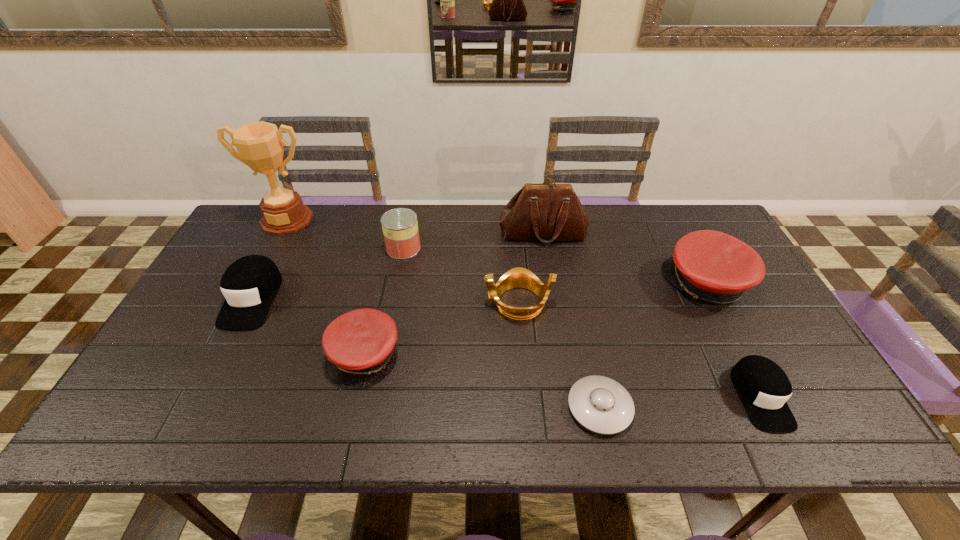
Locate an element on the screen. Image resolution: width=960 pixels, height=540 pixels. the smaller red cap is located at coordinates pos(357,344).

Find the location of a particular element. Image resolution: width=960 pixels, height=540 pixels. the right black cap is located at coordinates (763, 386).

Where is `the second shortest object`? the second shortest object is located at coordinates (763, 386).

Locate an element on the screen. This screenshot has width=960, height=540. the shortest object is located at coordinates (600, 404).

The image size is (960, 540). I want to click on gray saucer, so click(600, 404).

I want to click on free space located on the front-facing side of the tallest object, so click(256, 278).

You are a GUI agent. You are given a task and a screenshot of the screen. Output one action in this format:
    pyautogui.click(x=<x>, y=<y>)
    Task: Click on the free point located 0.260m on the front of the shoulder bag
    
    Given the screenshot: What is the action you would take?
    pyautogui.click(x=555, y=308)

Identify the location of free region located 0.350m on the front of the can. (383, 352).

The height and width of the screenshot is (540, 960). I want to click on blank space located on the front-facing side of the bigger red cap, so click(587, 284).

Where is `vacant space situated 0.110m on the front-facing side of the bigger red cap`? Image resolution: width=960 pixels, height=540 pixels. vacant space situated 0.110m on the front-facing side of the bigger red cap is located at coordinates (628, 284).